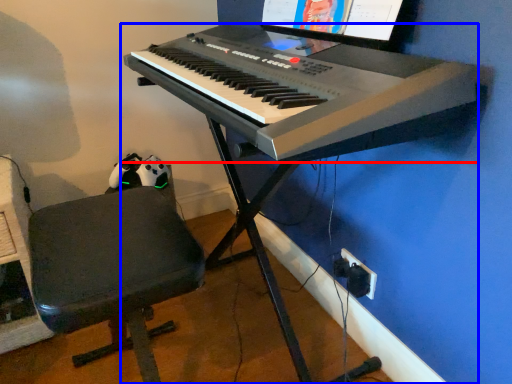
Question: Among these objects, which one is farthest to the camera, musical keyboard (highlighted by a red box) or piano (highlighted by a blue box)?

Choices:
 (A) musical keyboard
 (B) piano

Answer: (B)